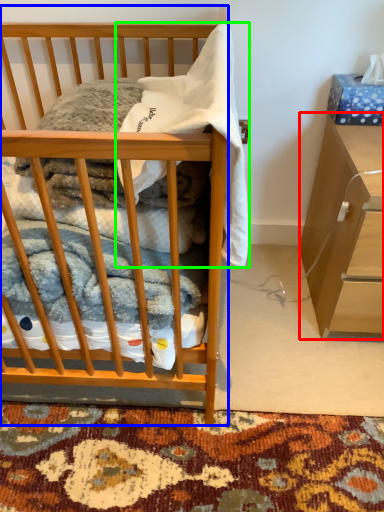
Question: Considering the real-world distances, which object is closest to cabinetry (highlighted by a red box)? desk (highlighted by a blue box) or baby clothe (highlighted by a green box).

Choices:
 (A) desk
 (B) baby clothe

Answer: (B)